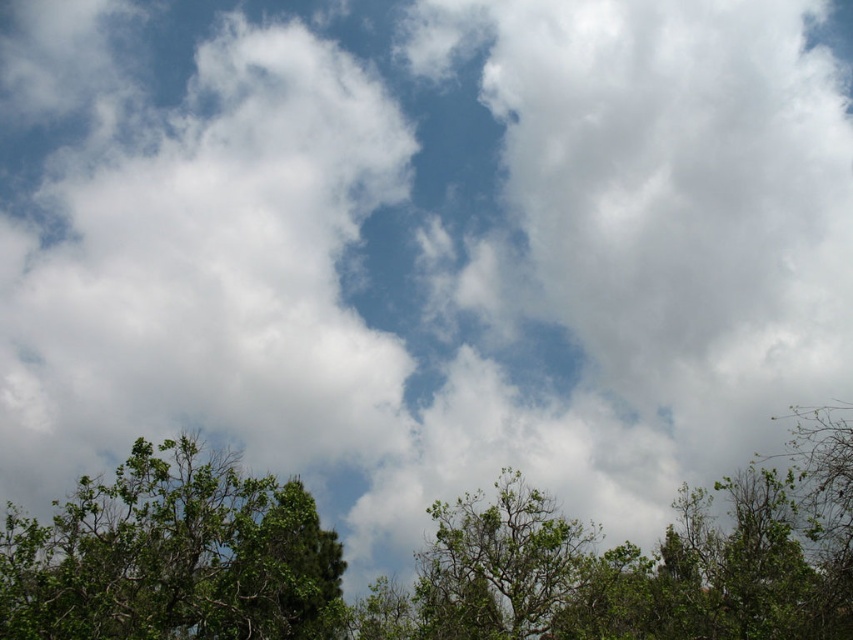
You are standing in a forest clearing and want to find the tallest tree between the green leafy tree at lower left and the green leafy tree at center. Which tree should you look towards?

The green leafy tree at center is taller than the green leafy tree at lower left, so you should look towards the green leafy tree at center.

You are standing in a forest and looking up at the sky. You see two trees, the green leafy tree at lower left and the green leafy tree at center. Which tree is positioned more to the left side?

The green leafy tree at lower left is positioned more to the left side than the green leafy tree at center.

You are standing in a forest and looking up at the sky. You notice two trees, the green leafy tree at lower left and the green leafy tree at center. Which tree has a narrower width?

The green leafy tree at lower left has a lesser width compared to the green leafy tree at center, so the green leafy tree at lower left is narrower.